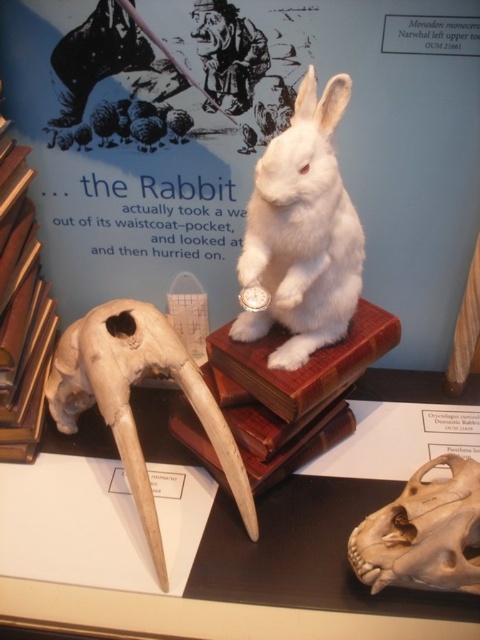
You are a visitor at the museum exhibit and see the white matte skull at lower left and the brown bone skull at lower right. Which one is positioned more to the left side of the display?

The white matte skull at lower left is positioned more to the left side of the display than the brown bone skull at lower right.

You are a visitor at the museum and you want to take a photo of the white plush rabbit at center and the brown bone skull at lower right. Which object should you focus on first if you want to capture both in the same frame without moving the camera?

The white plush rabbit at center is to the left of brown bone skull at lower right, so you should focus on the white plush rabbit at center first to ensure both are in the frame.

You are a visitor at the museum and you see the white matte skull at lower left and the brown leather book at left. Which object is positioned more to the right side?

The white matte skull at lower left is positioned more to the right side than the brown leather book at left.